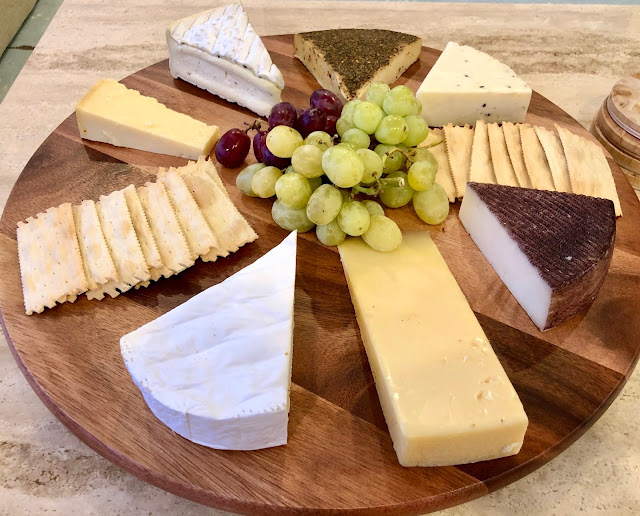
Find the location of a particular element. The image size is (640, 516). wood coaster is located at coordinates (628, 138).